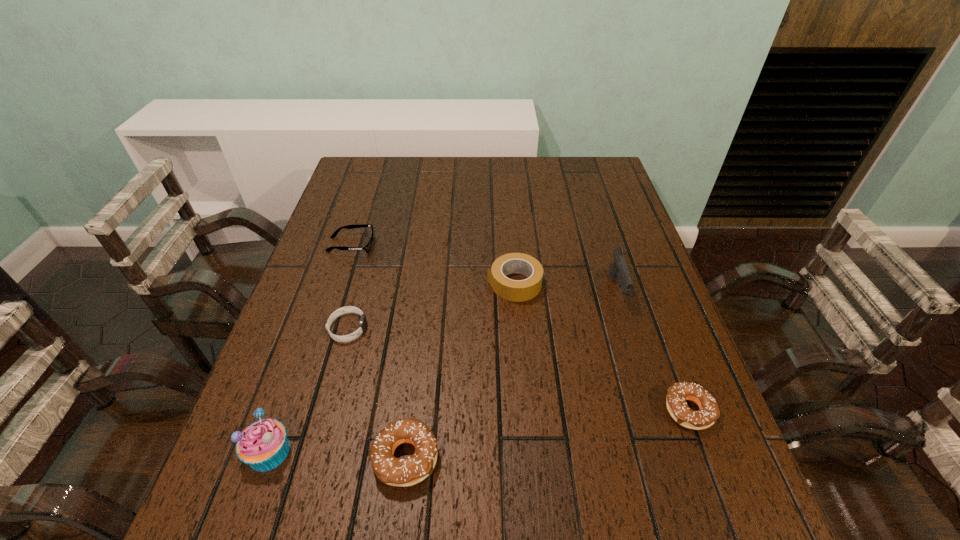
Find the location of `vacant space that satisfies the following two spatial constraints: 1. on the back side of the left doughnut; 2. on the left side of the rightmost object`. vacant space that satisfies the following two spatial constraints: 1. on the back side of the left doughnut; 2. on the left side of the rightmost object is located at coordinates (411, 410).

Locate an element on the screen. This screenshot has width=960, height=540. vacant space that satisfies the following two spatial constraints: 1. on the front-facing side of the fourth object from left to right; 2. on the right side of the farthest object is located at coordinates pyautogui.click(x=282, y=457).

Where is `blank area in the image that satisfies the following two spatial constraints: 1. at the barrel of the pistol; 2. on the left side of the right doughnut`? Image resolution: width=960 pixels, height=540 pixels. blank area in the image that satisfies the following two spatial constraints: 1. at the barrel of the pistol; 2. on the left side of the right doughnut is located at coordinates (654, 410).